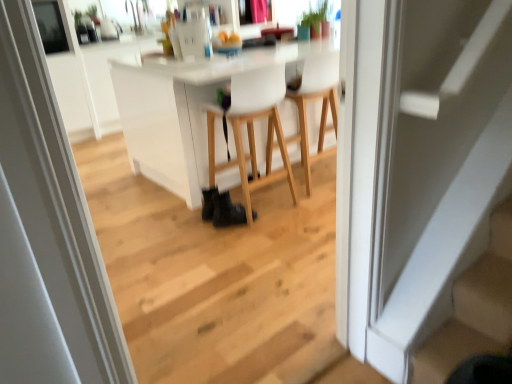
Question: Is white glossy door at center outside white matte chair at center, acting as the second chair starting from the left?

Choices:
 (A) yes
 (B) no

Answer: (A)

Question: Is white glossy door at center facing towards white matte chair at center, placed as the first chair when sorted from right to left?

Choices:
 (A) yes
 (B) no

Answer: (A)

Question: Is white glossy door at center facing away from white matte chair at center, placed as the first chair when sorted from right to left?

Choices:
 (A) no
 (B) yes

Answer: (A)

Question: Is white matte chair at center, placed as the first chair when sorted from right to left, a part of white glossy door at center?

Choices:
 (A) no
 (B) yes

Answer: (A)

Question: Is white glossy door at center in front of white matte chair at center, acting as the second chair starting from the left?

Choices:
 (A) yes
 (B) no

Answer: (A)

Question: From a real-world perspective, is black leather shoe at lower center above or below white matte chair at center, the 1th chair positioned from the left?

Choices:
 (A) below
 (B) above

Answer: (A)

Question: Choose the correct answer: Is black leather shoe at lower center inside white matte chair at center, the 1th chair positioned from the left, or outside it?

Choices:
 (A) inside
 (B) outside

Answer: (A)

Question: Considering the positions of black leather shoe at lower center and white matte chair at center, the 1th chair positioned from the left, in the image, is black leather shoe at lower center taller or shorter than white matte chair at center, the 1th chair positioned from the left,?

Choices:
 (A) short
 (B) tall

Answer: (A)

Question: Is black leather shoe at lower center bigger or smaller than white matte chair at center, the second chair viewed from the right?

Choices:
 (A) big
 (B) small

Answer: (B)

Question: Considering the relative positions of black leather shoe at lower center and white matte stair at lower right in the image provided, is black leather shoe at lower center to the left or to the right of white matte stair at lower right?

Choices:
 (A) left
 (B) right

Answer: (A)

Question: Based on their sizes in the image, would you say black leather shoe at lower center is bigger or smaller than white matte stair at lower right?

Choices:
 (A) small
 (B) big

Answer: (A)

Question: From the image's perspective, is black leather shoe at lower center positioned above or below white matte stair at lower right?

Choices:
 (A) above
 (B) below

Answer: (A)

Question: Is point (220, 223) positioned closer to the camera than point (506, 256)?

Choices:
 (A) farther
 (B) closer

Answer: (A)

Question: From the image's perspective, is white matte chair at center, the 1th chair positioned from the left, located above or below white matte chair at center, placed as the first chair when sorted from right to left?

Choices:
 (A) below
 (B) above

Answer: (A)

Question: Is white matte chair at center, the second chair viewed from the right, situated inside white matte chair at center, acting as the second chair starting from the left, or outside?

Choices:
 (A) inside
 (B) outside

Answer: (B)